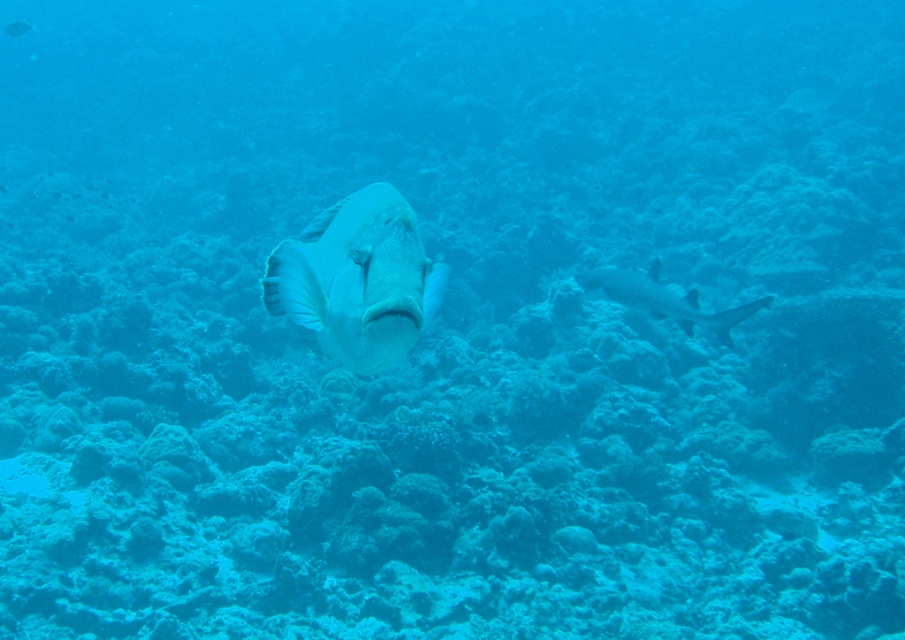
You are a marine biologist observing an underwater scene. You notice a white matte fish at center and a smooth gray shark at center. Based on their positions, which one is closer to the ocean floor?

The white matte fish at center is below the smooth gray shark at center, so it is closer to the ocean floor.

You are a marine biologist observing an underwater scene. You notice a white matte fish at center and a smooth gray shark at center. Based on their positions, which one is closer to your viewpoint?

The white matte fish at center is closer to your viewpoint because it is positioned in front of the smooth gray shark at center.